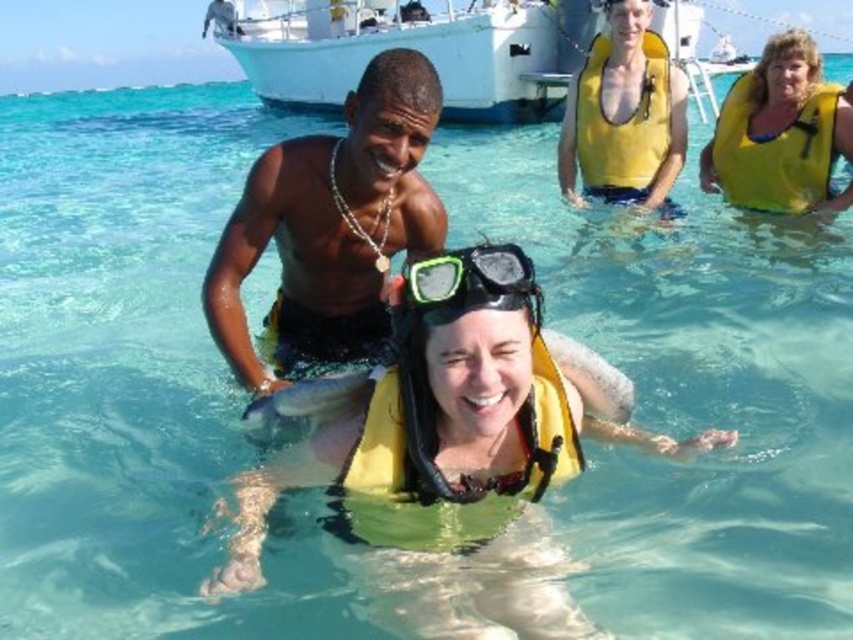
You are a swimmer in the water and see the white plastic boat at upper center and the shiny silver fish at center. Which object is located to the right of the other?

The white plastic boat at upper center is positioned on the right side of shiny silver fish at center.

You are a lifeguard on duty at the beach. You notice a white plastic boat at upper center and a yellow life vest at upper center in the water. A swimmer is in distress 20 meters away from the boat. Can you reach the swimmer faster by taking the boat or the life vest?

The distance of white plastic boat at upper center from yellow life vest at upper center is 21.03 meters. Since the swimmer is 20 meters away from the boat, the life vest is closer to the boat than the swimmer. Therefore, you can reach the swimmer faster by taking the boat first and then the life vest.

You are a lifeguard on duty at the beach. You see the white plastic boat at upper center and the yellow life vest at upper right in the water. Which object is positioned higher in the image?

The white plastic boat at upper center is located above the yellow life vest at upper right in the image.